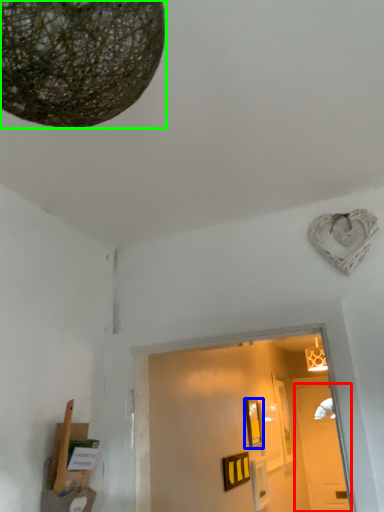
Question: Estimate the real-world distances between objects in this image. Which object is closer to door (highlighted by a red box), picture frame (highlighted by a blue box) or lamp (highlighted by a green box)?

Choices:
 (A) picture frame
 (B) lamp

Answer: (A)